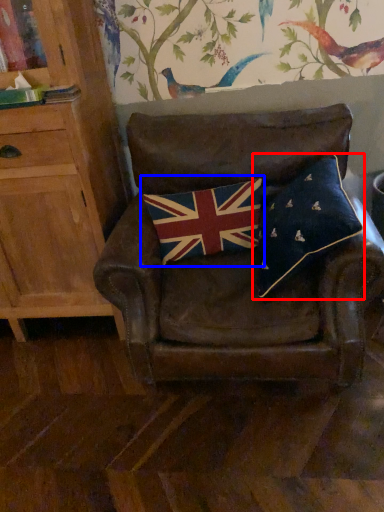
Question: Among these objects, which one is farthest to the camera, pillow (highlighted by a red box) or flag (highlighted by a blue box)?

Choices:
 (A) pillow
 (B) flag

Answer: (B)